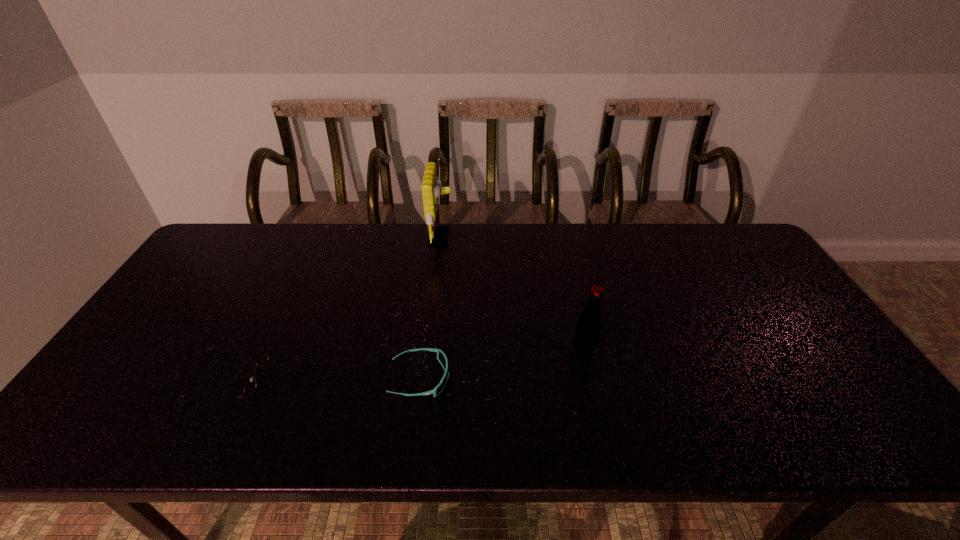
Identify the location of vacant space that's between the rightmost object and the right sunglasses. Image resolution: width=960 pixels, height=540 pixels. (502, 364).

Where is `free spot between the right sunglasses and the left sunglasses`? free spot between the right sunglasses and the left sunglasses is located at coordinates (324, 379).

I want to click on vacant point located between the second tallest object and the farthest object, so click(x=513, y=294).

Where is `unoccupied area between the leftmost object and the right sunglasses`? The image size is (960, 540). unoccupied area between the leftmost object and the right sunglasses is located at coordinates (324, 379).

This screenshot has height=540, width=960. What are the coordinates of `object that ranks as the closest to the right sunglasses` in the screenshot? It's located at (589, 325).

At what (x,y) coordinates should I click in order to perform the action: click on object that can be found as the third closest to the farthest object. Please return your answer as a coordinate pair (x, y). Looking at the image, I should click on click(250, 388).

Where is `blank area in the image that satisfies the following two spatial constraints: 1. on the face of the sponge; 2. on the back side of the second tallest object`? This screenshot has width=960, height=540. blank area in the image that satisfies the following two spatial constraints: 1. on the face of the sponge; 2. on the back side of the second tallest object is located at coordinates (429, 350).

Where is `vacant area that satisfies the following two spatial constraints: 1. on the face of the beer bottle; 2. on the left side of the sponge`? The height and width of the screenshot is (540, 960). vacant area that satisfies the following two spatial constraints: 1. on the face of the beer bottle; 2. on the left side of the sponge is located at coordinates (429, 350).

Where is `vacant position in the image that satisfies the following two spatial constraints: 1. on the face of the sponge; 2. on the left side of the third shortest object`? The width and height of the screenshot is (960, 540). vacant position in the image that satisfies the following two spatial constraints: 1. on the face of the sponge; 2. on the left side of the third shortest object is located at coordinates (429, 350).